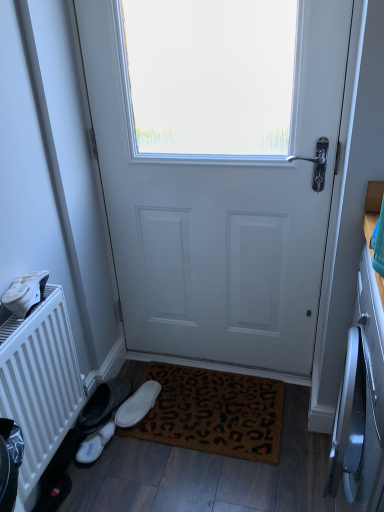
The height and width of the screenshot is (512, 384). What do you see at coordinates (219, 211) in the screenshot?
I see `white matte door at center` at bounding box center [219, 211].

Image resolution: width=384 pixels, height=512 pixels. Describe the element at coordinates (210, 411) in the screenshot. I see `brown coir doormat at lower center` at that location.

You are a GUI agent. You are given a task and a screenshot of the screen. Output one action in this format:
    pyautogui.click(x=<x>, y=<y>)
    Task: Click on the white suede slipper at lower left, marked as the second footwear in a left-to-right arrangement
    The width and height of the screenshot is (384, 512).
    Given the screenshot: What is the action you would take?
    pyautogui.click(x=138, y=405)

You are a GUI agent. You are given a task and a screenshot of the screen. Output one action in this format:
    pyautogui.click(x=<x>, y=<y>)
    Task: Click on the white suede slippers at lower left, the 1th footwear from the left
    
    Given the screenshot: What is the action you would take?
    pyautogui.click(x=95, y=444)

Where is `white matte radiator at left`? The image size is (384, 512). white matte radiator at left is located at coordinates (40, 383).

From the image's perspective, which object appears higher, white matte door at center or white matte radiator at left?

white matte door at center.

I want to click on radiator below the white matte door at center (from the image's perspective), so click(x=40, y=383).

Considering the relative positions of white matte door at center and white matte radiator at left in the image provided, is white matte door at center in front of white matte radiator at left?

No, the depth of white matte door at center is greater than that of white matte radiator at left.

Considering the relative sizes of white matte door at center and white matte radiator at left in the image provided, is white matte door at center taller than white matte radiator at left?

Indeed, white matte door at center has a greater height compared to white matte radiator at left.

Which object is positioned more to the right, white matte door at center or brown coir doormat at lower center?

Positioned to the right is white matte door at center.

Based on the photo, is white matte door at center facing away from brown coir doormat at lower center?

No, white matte door at center is not facing away from brown coir doormat at lower center.

Which point is more distant from viewer, (233,192) or (203,412)?

The point (203,412) is farther.

From a real-world perspective, is white matte door at center under brown coir doormat at lower center?

No.

Is point (130, 397) farther from camera compared to point (169, 421)?

That is True.

Is white suede slipper at lower left, the first footwear from the right, in contact with brown coir doormat at lower center?

No, white suede slipper at lower left, the first footwear from the right, is not touching brown coir doormat at lower center.

From their relative heights in the image, would you say white suede slipper at lower left, the first footwear from the right, is taller or shorter than brown coir doormat at lower center?

Considering their sizes, white suede slipper at lower left, the first footwear from the right, has more height than brown coir doormat at lower center.

Can you confirm if white suede slipper at lower left, marked as the second footwear in a left-to-right arrangement, is thinner than brown coir doormat at lower center?

Yes, white suede slipper at lower left, marked as the second footwear in a left-to-right arrangement, is thinner than brown coir doormat at lower center.

Between white matte radiator at left and white suede slippers at lower left, the 1th footwear from the left, which one has smaller size?

Smaller between the two is white suede slippers at lower left, the 1th footwear from the left.

Does point (40, 449) come closer to viewer compared to point (75, 458)?

Yes, point (40, 449) is in front of point (75, 458).

Between white matte radiator at left and white suede slippers at lower left, the 1th footwear from the left, which one has larger width?

With larger width is white matte radiator at left.

Considering the sizes of objects white matte door at center and white suede slippers at lower left, the 1th footwear from the left, in the image provided, who is shorter, white matte door at center or white suede slippers at lower left, the 1th footwear from the left,?

white suede slippers at lower left, the 1th footwear from the left, is shorter.

Is white matte door at center not close to white suede slippers at lower left, the 1th footwear from the left?

No, white matte door at center is in close proximity to white suede slippers at lower left, the 1th footwear from the left.

Measure the distance from white matte door at center to white suede slippers at lower left, the 1th footwear from the left.

white matte door at center and white suede slippers at lower left, the 1th footwear from the left, are 32.66 inches apart.

Considering the sizes of objects white matte door at center and white suede slippers at lower left, the 1th footwear from the left, in the image provided, who is bigger, white matte door at center or white suede slippers at lower left, the 1th footwear from the left,?

white matte door at center is bigger.

Is white suede slippers at lower left, arranged as the 2th footwear when viewed from the right, bigger or smaller than white suede slipper at lower left, marked as the second footwear in a left-to-right arrangement?

white suede slippers at lower left, arranged as the 2th footwear when viewed from the right, is smaller than white suede slipper at lower left, marked as the second footwear in a left-to-right arrangement.

You are a GUI agent. You are given a task and a screenshot of the screen. Output one action in this format:
    pyautogui.click(x=<x>, y=<y>)
    Task: Click on the footwear above the white suede slippers at lower left, arranged as the 2th footwear when viewed from the right (from the image's perspective)
    Image resolution: width=384 pixels, height=512 pixels.
    Given the screenshot: What is the action you would take?
    pyautogui.click(x=138, y=405)

Is white suede slippers at lower left, arranged as the 2th footwear when viewed from the right, facing away from white suede slipper at lower left, the first footwear from the right?

No, white suede slipper at lower left, the first footwear from the right, is not at the back of white suede slippers at lower left, arranged as the 2th footwear when viewed from the right.

Which point is more distant from viewer, (106,426) or (126,414)?

The point (126,414) is behind.

Choose the correct answer: Is white suede slipper at lower left, marked as the second footwear in a left-to-right arrangement, inside white suede slippers at lower left, arranged as the 2th footwear when viewed from the right, or outside it?

white suede slipper at lower left, marked as the second footwear in a left-to-right arrangement, exists outside the volume of white suede slippers at lower left, arranged as the 2th footwear when viewed from the right.

From a real-world perspective, does white suede slipper at lower left, the first footwear from the right, sit lower than white suede slippers at lower left, the 1th footwear from the left?

No, from a real-world perspective, white suede slipper at lower left, the first footwear from the right, is not beneath white suede slippers at lower left, the 1th footwear from the left.

Consider the image. Which object is further away from the camera taking this photo, white suede slipper at lower left, the first footwear from the right, or white suede slippers at lower left, arranged as the 2th footwear when viewed from the right?

Positioned behind is white suede slipper at lower left, the first footwear from the right.

The width and height of the screenshot is (384, 512). Identify the location of door behind the white matte radiator at left. (219, 211).

The height and width of the screenshot is (512, 384). What are the coordinates of `door on the right side of brown coir doormat at lower center` in the screenshot? It's located at (219, 211).

Looking at the image, which one is located closer to white suede slipper at lower left, marked as the second footwear in a left-to-right arrangement, brown coir doormat at lower center or white suede slippers at lower left, arranged as the 2th footwear when viewed from the right?

The object closer to white suede slipper at lower left, marked as the second footwear in a left-to-right arrangement, is white suede slippers at lower left, arranged as the 2th footwear when viewed from the right.

Based on their spatial positions, is white matte door at center or white matte radiator at left further from brown coir doormat at lower center?

white matte radiator at left is further to brown coir doormat at lower center.

Based on their spatial positions, is white suede slipper at lower left, the first footwear from the right, or white matte door at center further from brown coir doormat at lower center?

The object further to brown coir doormat at lower center is white matte door at center.

Consider the image. Based on their spatial positions, is white suede slippers at lower left, arranged as the 2th footwear when viewed from the right, or white matte door at center further from white suede slipper at lower left, marked as the second footwear in a left-to-right arrangement?

white matte door at center lies further to white suede slipper at lower left, marked as the second footwear in a left-to-right arrangement, than the other object.

From the image, which object appears to be nearer to white suede slippers at lower left, the 1th footwear from the left, white suede slipper at lower left, marked as the second footwear in a left-to-right arrangement, or white matte radiator at left?

white suede slipper at lower left, marked as the second footwear in a left-to-right arrangement, is positioned closer to the anchor white suede slippers at lower left, the 1th footwear from the left.

Which object lies further to the anchor point brown coir doormat at lower center, white matte door at center or white suede slipper at lower left, the first footwear from the right?

white matte door at center is positioned further to the anchor brown coir doormat at lower center.

Estimate the real-world distances between objects in this image. Which object is further from brown coir doormat at lower center, white suede slipper at lower left, the first footwear from the right, or white matte radiator at left?

white matte radiator at left is further to brown coir doormat at lower center.

From the image, which object appears to be farther from white matte radiator at left, brown coir doormat at lower center or white suede slipper at lower left, the first footwear from the right?

The object further to white matte radiator at left is brown coir doormat at lower center.

The width and height of the screenshot is (384, 512). In order to click on radiator between white matte door at center and brown coir doormat at lower center in the vertical direction in this screenshot , I will do `click(40, 383)`.

The image size is (384, 512). I want to click on radiator between white matte door at center and white suede slippers at lower left, arranged as the 2th footwear when viewed from the right, in the vertical direction, so click(x=40, y=383).

At what (x,y) coordinates should I click in order to perform the action: click on footwear situated between white suede slippers at lower left, arranged as the 2th footwear when viewed from the right, and brown coir doormat at lower center from left to right. Please return your answer as a coordinate pair (x, y). This screenshot has width=384, height=512. Looking at the image, I should click on (138, 405).

Find the location of a particular element. The image size is (384, 512). doormat between white matte door at center and white suede slippers at lower left, arranged as the 2th footwear when viewed from the right, in the vertical direction is located at coordinates (210, 411).